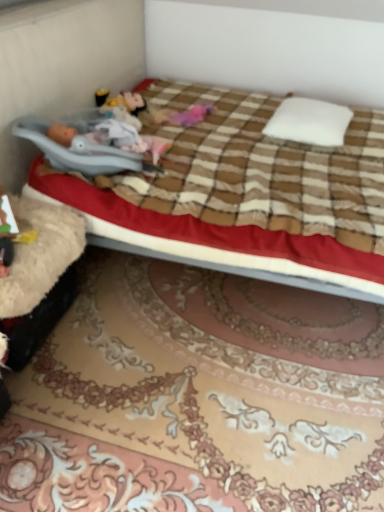
Identify the location of white soft pillow at center. The image size is (384, 512). (309, 122).

This screenshot has height=512, width=384. Describe the element at coordinates (309, 122) in the screenshot. I see `white soft pillow at center` at that location.

The height and width of the screenshot is (512, 384). Find the location of `brown plaid blanket at center`. brown plaid blanket at center is located at coordinates (246, 196).

The width and height of the screenshot is (384, 512). What do you see at coordinates (183, 115) in the screenshot? I see `pink fabric doll at center` at bounding box center [183, 115].

Find the location of `white soft pillow at center`. white soft pillow at center is located at coordinates (309, 122).

From a real-world perspective, is brown plaid blanket at center over pink fabric doll at center?

No.

In the scene shown: From the image's perspective, which one is positioned higher, brown plaid blanket at center or pink fabric doll at center?

pink fabric doll at center is shown above in the image.

From their relative heights in the image, would you say brown plaid blanket at center is taller or shorter than pink fabric doll at center?

brown plaid blanket at center is taller than pink fabric doll at center.

Could you tell me if brown plaid blanket at center is turned towards pink fabric doll at center?

No, brown plaid blanket at center is not aimed at pink fabric doll at center.

Can you confirm if pink fabric doll at center is thinner than brown plaid blanket at center?

Yes, pink fabric doll at center is thinner than brown plaid blanket at center.

Is pink fabric doll at center further to the viewer compared to brown plaid blanket at center?

Yes.

Measure the distance from pink fabric doll at center to brown plaid blanket at center.

They are 21.98 inches apart.

Does pink fabric doll at center have a greater height compared to brown plaid blanket at center?

No, pink fabric doll at center is not taller than brown plaid blanket at center.

Is point (299, 129) closer or farther from the camera than point (156, 118)?

Point (299, 129) is closer to the camera than point (156, 118).

Is white soft pillow at center positioned before pink fabric doll at center?

Yes, white soft pillow at center is closer to the camera.

Is white soft pillow at center wider than pink fabric doll at center?

Yes.

From a real-world perspective, is white soft pillow at center positioned above or below pink fabric doll at center?

white soft pillow at center is above pink fabric doll at center.

How different are the orientations of brown plaid blanket at center and white soft pillow at center in degrees?

brown plaid blanket at center and white soft pillow at center are facing 97.2 degrees away from each other.

Is point (278, 245) closer or farther from the camera than point (317, 114)?

Point (278, 245) appears to be closer to the viewer than point (317, 114).

From the image's perspective, between brown plaid blanket at center and white soft pillow at center, which one is located above?

white soft pillow at center.

From a real-world perspective, does brown plaid blanket at center stand above white soft pillow at center?

Actually, brown plaid blanket at center is physically below white soft pillow at center in the real world.

Can you confirm if pink fabric doll at center is smaller than white soft pillow at center?

Indeed, pink fabric doll at center has a smaller size compared to white soft pillow at center.

Consider the image. In terms of width, does pink fabric doll at center look wider or thinner when compared to white soft pillow at center?

pink fabric doll at center is thinner than white soft pillow at center.

Is pink fabric doll at center not near white soft pillow at center?

pink fabric doll at center is actually quite close to white soft pillow at center.

Looking at this image, from the image's perspective, would you say white soft pillow at center is positioned over brown plaid blanket at center?

Indeed, from the image's perspective, white soft pillow at center is shown above brown plaid blanket at center.

You are a GUI agent. You are given a task and a screenshot of the screen. Output one action in this format:
    pyautogui.click(x=<x>, y=<y>)
    Task: Click on the bed beneath the white soft pillow at center (from a real-world perspective)
    
    Given the screenshot: What is the action you would take?
    pyautogui.click(x=246, y=196)

Are white soft pillow at center and brown plaid blanket at center located far from each other?

Actually, white soft pillow at center and brown plaid blanket at center are a little close together.

Where is `toy lying above the brown plaid blanket at center (from the image's perspective)`? This screenshot has width=384, height=512. toy lying above the brown plaid blanket at center (from the image's perspective) is located at coordinates (183, 115).

Where is `toy above the brown plaid blanket at center (from a real-world perspective)`? This screenshot has width=384, height=512. toy above the brown plaid blanket at center (from a real-world perspective) is located at coordinates (183, 115).

Based on their spatial positions, is pink fabric doll at center or white soft pillow at center closer to brown plaid blanket at center?

white soft pillow at center is positioned closer to the anchor brown plaid blanket at center.

Which object lies further to the anchor point white soft pillow at center, pink fabric doll at center or brown plaid blanket at center?

pink fabric doll at center.

From the image, which object appears to be nearer to white soft pillow at center, brown plaid blanket at center or pink fabric doll at center?

brown plaid blanket at center is positioned closer to the anchor white soft pillow at center.

Which object lies nearer to the anchor point pink fabric doll at center, brown plaid blanket at center or white soft pillow at center?

Based on the image, white soft pillow at center appears to be nearer to pink fabric doll at center.

When comparing their distances from brown plaid blanket at center, does white soft pillow at center or pink fabric doll at center seem closer?

Among the two, white soft pillow at center is located nearer to brown plaid blanket at center.

Looking at the image, which one is located further to pink fabric doll at center, white soft pillow at center or brown plaid blanket at center?

Based on the image, brown plaid blanket at center appears to be further to pink fabric doll at center.

What are the coordinates of `pillow positioned between brown plaid blanket at center and pink fabric doll at center from near to far` in the screenshot? It's located at (x=309, y=122).